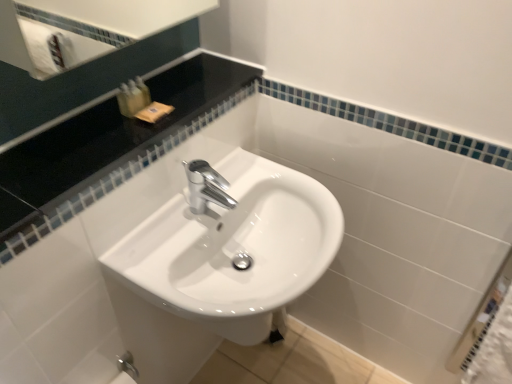
Question: Can you confirm if black glossy countertop at upper left is taller than translucent plastic soap at upper left, the 3th toiletry viewed from the right?

Choices:
 (A) yes
 (B) no

Answer: (B)

Question: Is black glossy countertop at upper left at the right side of translucent plastic soap at upper left, the 3th toiletry viewed from the right?

Choices:
 (A) yes
 (B) no

Answer: (A)

Question: Is black glossy countertop at upper left wider than translucent plastic soap at upper left, the 1th toiletry positioned from the left?

Choices:
 (A) no
 (B) yes

Answer: (B)

Question: From the image's perspective, does black glossy countertop at upper left appear lower than translucent plastic soap at upper left, the 1th toiletry positioned from the left?

Choices:
 (A) no
 (B) yes

Answer: (B)

Question: Is black glossy countertop at upper left surrounding translucent plastic soap at upper left, the 1th toiletry positioned from the left?

Choices:
 (A) no
 (B) yes

Answer: (A)

Question: Is black glossy countertop at upper left bigger than translucent plastic soap at upper left, the 3th toiletry viewed from the right?

Choices:
 (A) yes
 (B) no

Answer: (A)

Question: From the image's perspective, is translucent plastic soap at upper left, the 3th toiletry viewed from the right, on translucent plastic soap at upper left, which is counted as the third toiletry, starting from the left?

Choices:
 (A) no
 (B) yes

Answer: (A)

Question: Considering the relative sizes of translucent plastic soap at upper left, the 3th toiletry viewed from the right, and translucent plastic soap at upper left, which is counted as the third toiletry, starting from the left, in the image provided, is translucent plastic soap at upper left, the 3th toiletry viewed from the right, wider than translucent plastic soap at upper left, which is counted as the third toiletry, starting from the left,?

Choices:
 (A) no
 (B) yes

Answer: (B)

Question: Does translucent plastic soap at upper left, the 1th toiletry positioned from the left, lie in front of translucent plastic soap at upper left, which is the 1th toiletry in right-to-left order?

Choices:
 (A) no
 (B) yes

Answer: (B)

Question: Considering the relative positions of translucent plastic soap at upper left, the 1th toiletry positioned from the left, and translucent plastic soap at upper left, which is counted as the third toiletry, starting from the left, in the image provided, is translucent plastic soap at upper left, the 1th toiletry positioned from the left, to the right of translucent plastic soap at upper left, which is counted as the third toiletry, starting from the left, from the viewer's perspective?

Choices:
 (A) no
 (B) yes

Answer: (A)

Question: Is translucent plastic soap at upper left, the 1th toiletry positioned from the left, not inside translucent plastic soap at upper left, which is the 1th toiletry in right-to-left order?

Choices:
 (A) yes
 (B) no

Answer: (A)

Question: Considering the relative positions of translucent plastic soap at upper left, the 1th toiletry positioned from the left, and translucent plastic soap at upper left, which is counted as the third toiletry, starting from the left, in the image provided, is translucent plastic soap at upper left, the 1th toiletry positioned from the left, to the left of translucent plastic soap at upper left, which is counted as the third toiletry, starting from the left, from the viewer's perspective?

Choices:
 (A) no
 (B) yes

Answer: (B)

Question: Is white glossy sink at center inside translucent plastic soap at upper left, which is the 1th toiletry in right-to-left order?

Choices:
 (A) yes
 (B) no

Answer: (B)